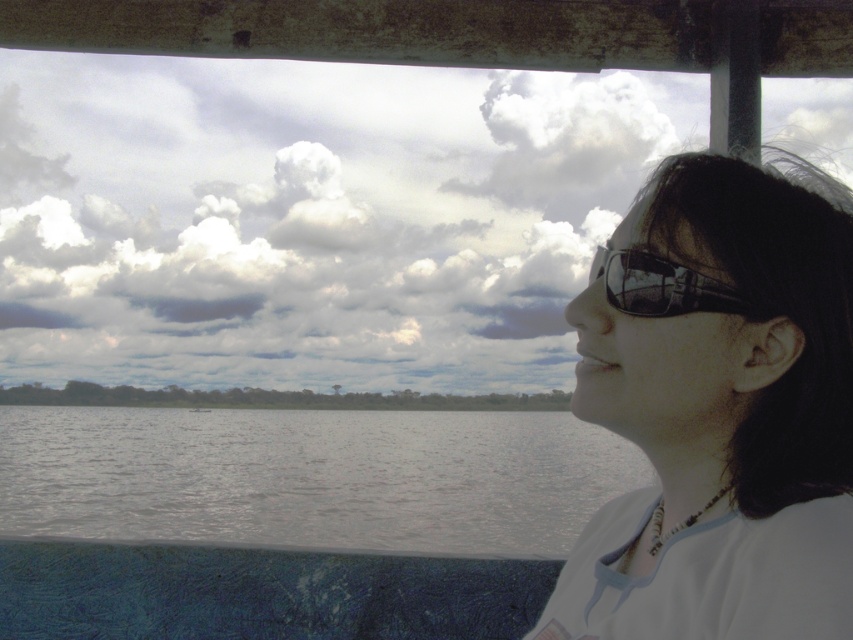
You are a photographer taking a picture of the scene. You have to decide whether the transparent plastic glasses at upper right will appear in front of or behind the gray matte water at center in the photo. Based on their positions, what would you observe?

The gray matte water at center is positioned under the transparent plastic glasses at upper right, so in the photo, the transparent plastic glasses at upper right will appear in front of the gray matte water at center.

You are standing on a boat and want to throw a small floating toy into the water. The toy requires at least 10 feet of space to float properly. Based on the scene, can you determine if the gray matte water at center has enough space for the toy?

The gray matte water at center is 9.46 feet from camera, which is less than the required 10 feet. Therefore, the space is insufficient for the toy to float properly.

You are a photographer trying to capture the person in the matte white shirt at right. If your camera has a zoom lens set to 50mm focal length, and you want to ensure the entire scene including the shirt is in focus, what should you consider about the shirt location?

The position of the matte white shirt at right is at point [718,410], so you should adjust the focus point to that coordinate to ensure the entire scene including the shirt is in focus.